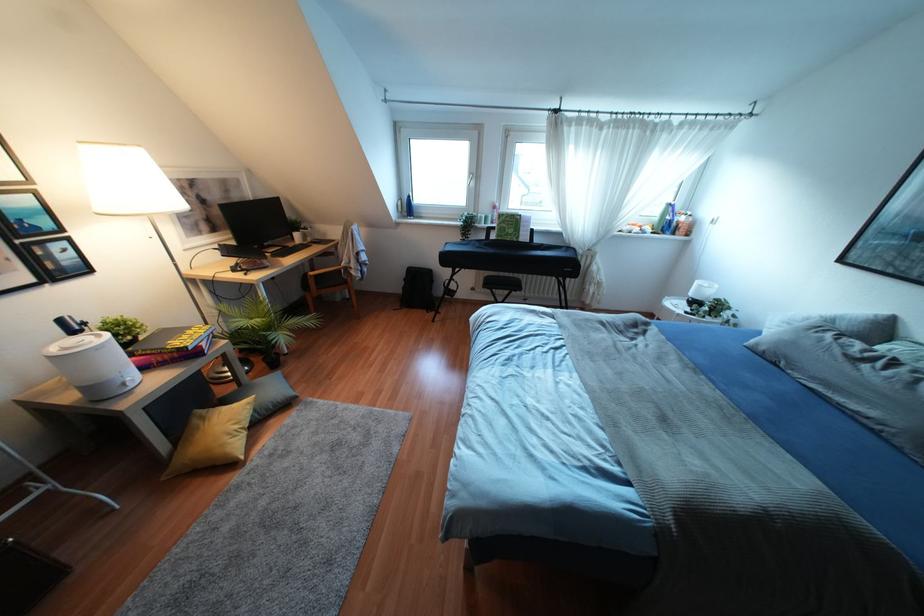
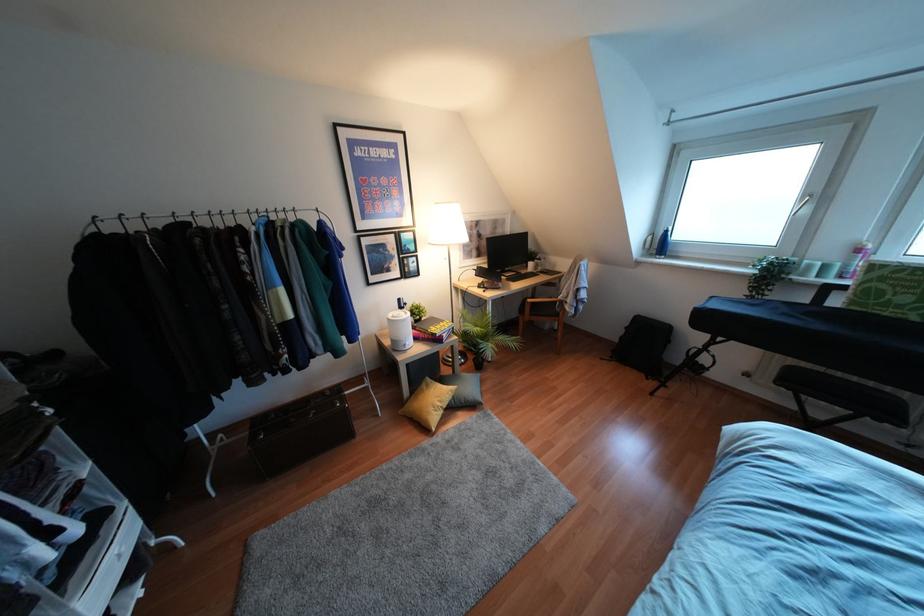
Locate, in the second image, the point that corresponds to [480,217] in the first image.

(809, 265)